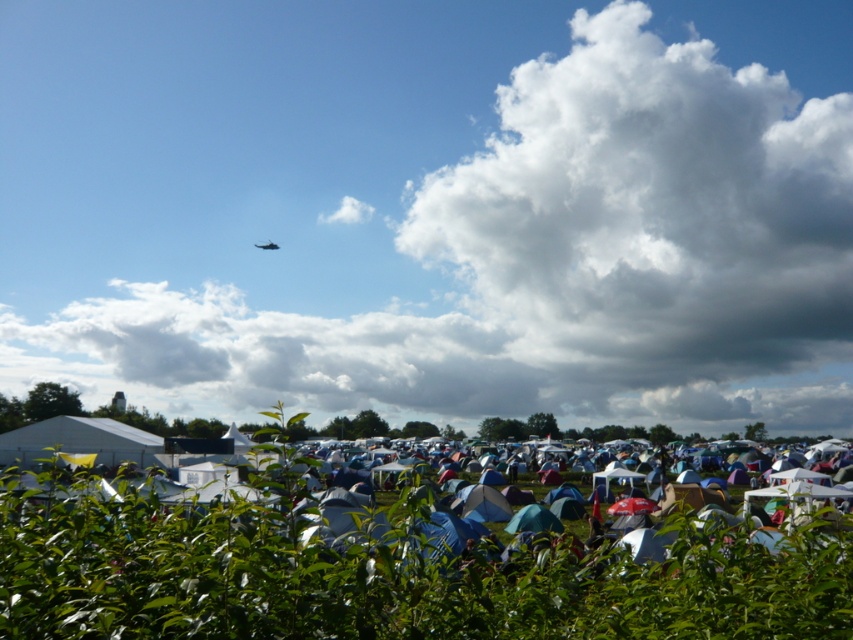
Question: Does blue fabric tent at center appear on the right side of metallic silver airplane at upper center?

Choices:
 (A) yes
 (B) no

Answer: (A)

Question: Which is nearer to the metallic silver airplane at upper center?

Choices:
 (A) blue fabric tent at center
 (B) white fluffy cloud at upper center

Answer: (B)

Question: Where is white fluffy cloud at upper center located in relation to blue fabric tent at center in the image?

Choices:
 (A) above
 (B) below

Answer: (A)

Question: Which object is positioned farthest from the blue fabric tent at center?

Choices:
 (A) metallic silver airplane at upper center
 (B) white fluffy cloud at upper center

Answer: (B)

Question: Can you confirm if white fluffy cloud at upper center is positioned to the left of blue fabric tent at center?

Choices:
 (A) yes
 (B) no

Answer: (A)

Question: Which object is farther from the camera taking this photo?

Choices:
 (A) white fluffy cloud at upper center
 (B) metallic silver airplane at upper center
 (C) blue fabric tent at center

Answer: (A)